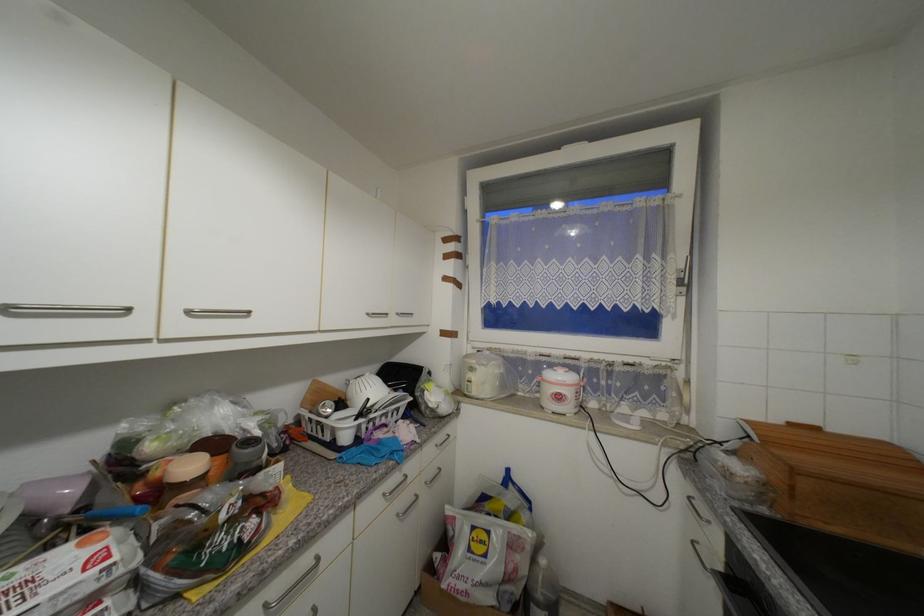
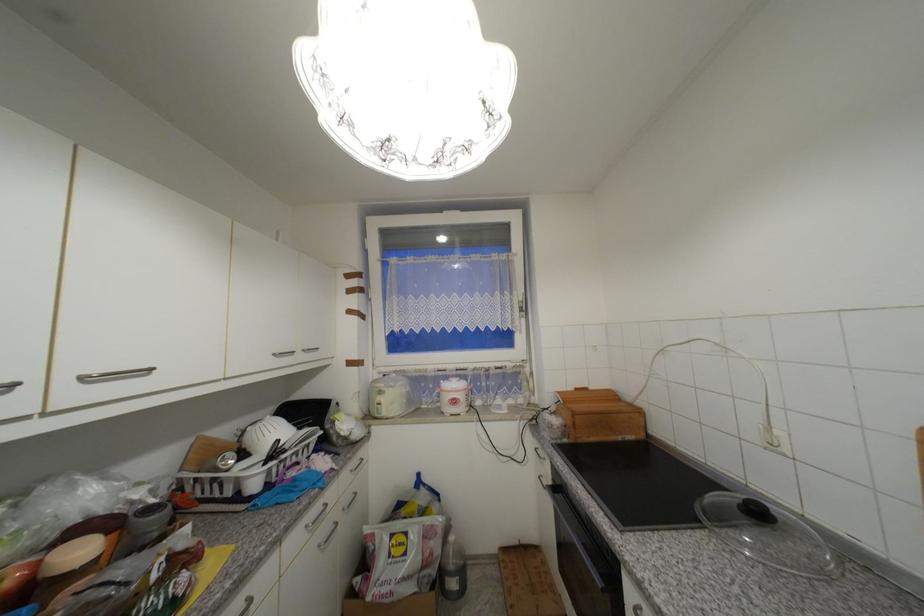
The point at (478, 371) is marked in the first image. Where is the corresponding point in the second image?

(386, 394)